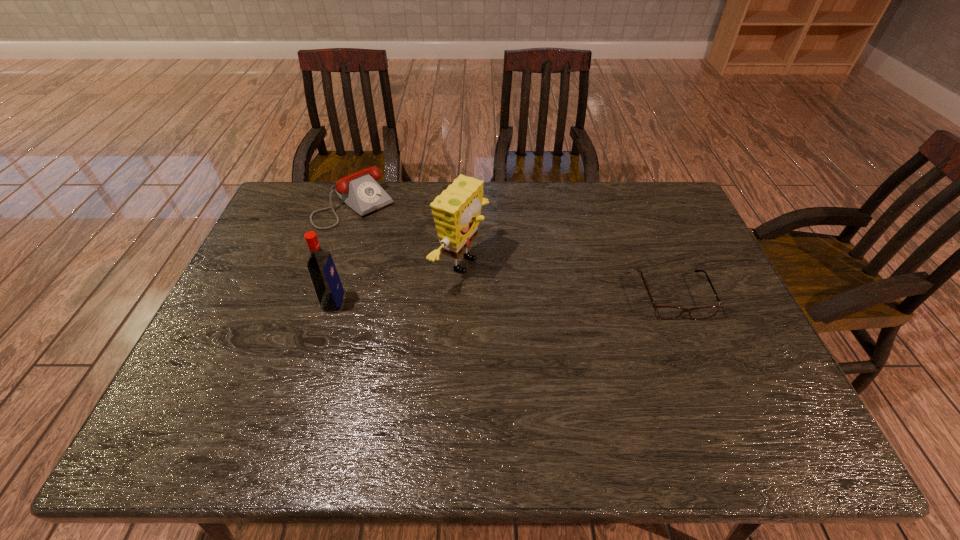
Identify the location of free area in between the telephone and the third object from left to right. 408,234.

The height and width of the screenshot is (540, 960). What are the coordinates of `free spot between the second object from right to left and the telephone` in the screenshot? It's located at (408, 234).

The width and height of the screenshot is (960, 540). I want to click on vacant space in between the vodka and the rightmost object, so click(504, 299).

Where is `empty space that is in between the vodka and the telephone`? The width and height of the screenshot is (960, 540). empty space that is in between the vodka and the telephone is located at coordinates (345, 253).

The width and height of the screenshot is (960, 540). I want to click on object that is the closest to the spectacles, so point(456,211).

I want to click on object that can be found as the third closest to the sponge, so click(x=662, y=312).

Find the location of a particular element. This screenshot has height=540, width=960. vacant space that satisfies the following two spatial constraints: 1. on the front side of the vodka; 2. on the front and back of the third tallest object is located at coordinates (324, 302).

Where is `free space that satisfies the following two spatial constraints: 1. on the front side of the vodka; 2. on the front and back of the telephone`? The image size is (960, 540). free space that satisfies the following two spatial constraints: 1. on the front side of the vodka; 2. on the front and back of the telephone is located at coordinates (324, 302).